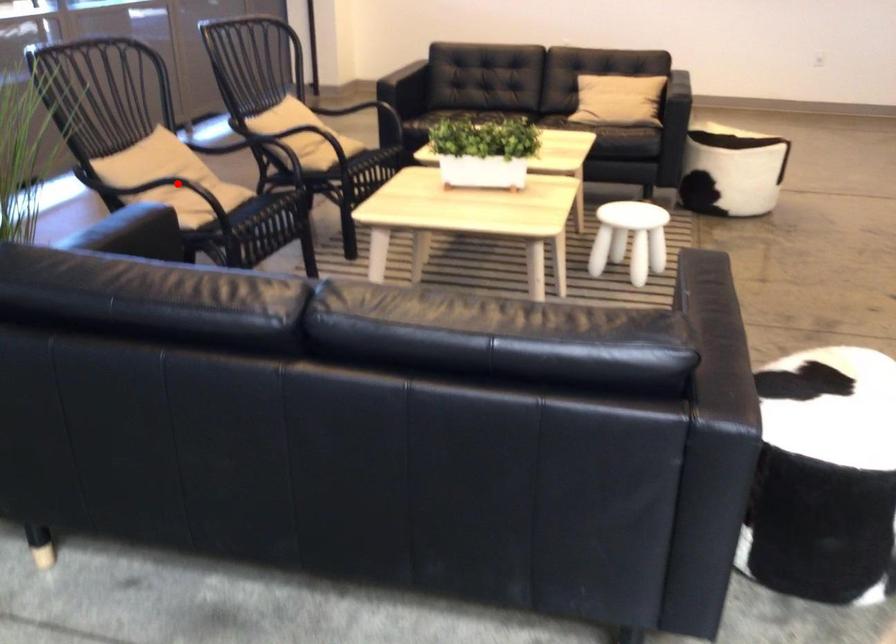
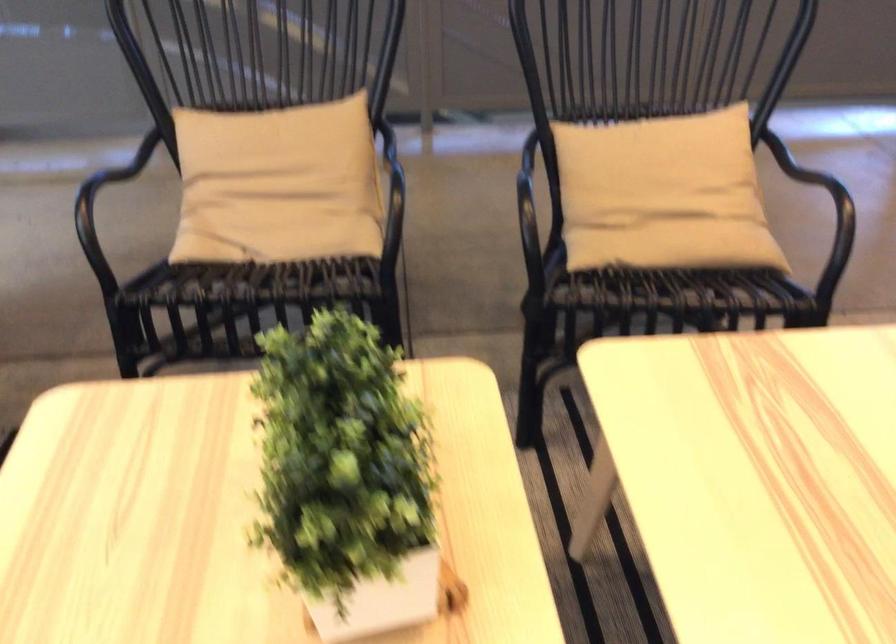
Question: A red point is marked in image1. In image2, is the corresponding 3D point closer to the camera or farther? Reply with the corresponding letter.

Choices:
 (A) The corresponding 3D point is closer.
 (B) The corresponding 3D point is farther.

Answer: (A)